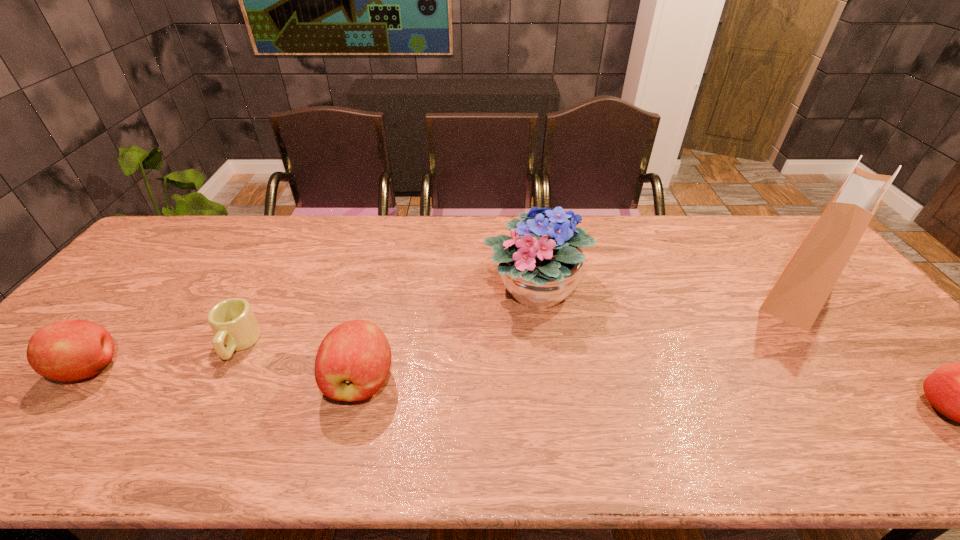
The image size is (960, 540). Identify the location of vacant region located with the handle on the side of the mug. (216, 386).

Where is `free point located on the front of the tallest object`? free point located on the front of the tallest object is located at coordinates (868, 382).

Locate an element on the screen. This screenshot has height=540, width=960. vacant area situated 0.080m on the left of the third object from right to left is located at coordinates (456, 290).

The width and height of the screenshot is (960, 540). Find the location of `object located in the far edge section of the desktop`. object located in the far edge section of the desktop is located at coordinates (540, 267).

Identify the location of object located in the left edge section of the desktop. (68, 350).

What are the coordinates of `object that is positioned at the right edge` in the screenshot? It's located at (801, 291).

Find the location of a particular element. The height and width of the screenshot is (540, 960). object that is at the near left corner is located at coordinates pos(68,350).

The image size is (960, 540). In the image, there is a desktop. In order to click on blank space at the far edge in this screenshot , I will do `click(290, 256)`.

Where is `vacant space at the near edge of the desktop`? vacant space at the near edge of the desktop is located at coordinates (96, 401).

In the image, there is a desktop. Where is `free space at the right edge`? free space at the right edge is located at coordinates (835, 309).